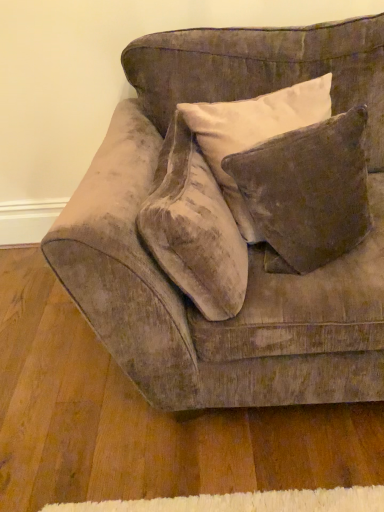
Question: Is velvet couch at center to the left of velvet brown pillow at upper right from the viewer's perspective?

Choices:
 (A) no
 (B) yes

Answer: (B)

Question: Considering the relative sizes of velvet couch at center and velvet brown pillow at upper right in the image provided, is velvet couch at center smaller than velvet brown pillow at upper right?

Choices:
 (A) yes
 (B) no

Answer: (B)

Question: Is there a large distance between velvet couch at center and velvet brown pillow at upper right?

Choices:
 (A) yes
 (B) no

Answer: (B)

Question: Is the depth of velvet couch at center less than that of velvet brown pillow at upper right?

Choices:
 (A) yes
 (B) no

Answer: (A)

Question: Is velvet brown pillow at upper right completely or partially inside velvet couch at center?

Choices:
 (A) no
 (B) yes

Answer: (B)

Question: In terms of height, does velvet brown pillow at upper right look taller or shorter compared to velvet beige throw pillow at center?

Choices:
 (A) short
 (B) tall

Answer: (B)

Question: Choose the correct answer: Is velvet brown pillow at upper right inside velvet beige throw pillow at center or outside it?

Choices:
 (A) inside
 (B) outside

Answer: (B)

Question: From the image's perspective, is velvet brown pillow at upper right above or below velvet beige throw pillow at center?

Choices:
 (A) above
 (B) below

Answer: (A)

Question: Considering their positions, is velvet brown pillow at upper right located in front of or behind velvet beige throw pillow at center?

Choices:
 (A) behind
 (B) front

Answer: (A)

Question: Considering the positions of point (299, 196) and point (142, 384), is point (299, 196) closer or farther from the camera than point (142, 384)?

Choices:
 (A) closer
 (B) farther

Answer: (A)

Question: From the image's perspective, relative to velvet couch at center, is velvet brown pillow at upper right above or below?

Choices:
 (A) below
 (B) above

Answer: (B)

Question: Considering the positions of velvet brown pillow at upper right and velvet couch at center in the image, is velvet brown pillow at upper right wider or thinner than velvet couch at center?

Choices:
 (A) thin
 (B) wide

Answer: (A)

Question: Is velvet brown pillow at upper right inside or outside of velvet couch at center?

Choices:
 (A) outside
 (B) inside

Answer: (B)

Question: Relative to velvet brown pillow at upper right, is velvet couch at center in front or behind?

Choices:
 (A) front
 (B) behind

Answer: (A)

Question: Is velvet couch at center inside the boundaries of velvet brown pillow at upper right, or outside?

Choices:
 (A) inside
 (B) outside

Answer: (B)